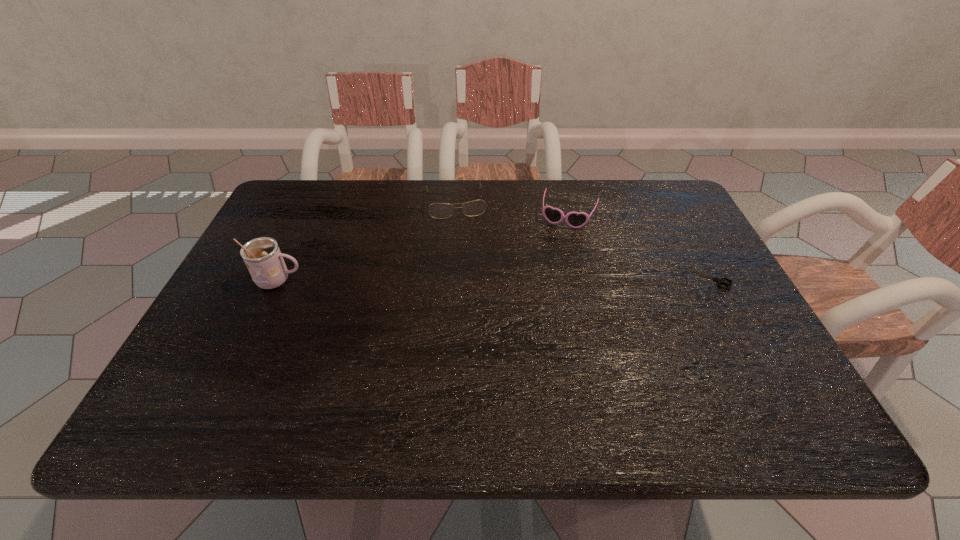
This screenshot has height=540, width=960. I want to click on free space that is in between the cup and the rightmost object, so click(x=494, y=279).

Find the location of a particular element. The height and width of the screenshot is (540, 960). empty space between the spectacles and the leftmost object is located at coordinates (367, 241).

Where is `vacant area between the third object from left to right and the rightmost object`? vacant area between the third object from left to right and the rightmost object is located at coordinates (639, 247).

Find the location of a particular element. The image size is (960, 540). vacant area between the cup and the spectacles is located at coordinates (367, 241).

Select which object is the closest to the shears. Please provide its 2D coordinates. Your answer should be formatted as a tuple, i.e. [(x, y)], where the tuple contains the x and y coordinates of a point satisfying the conditions above.

[(553, 215)]

This screenshot has width=960, height=540. I want to click on object identified as the third closest to the third object from right to left, so click(719, 280).